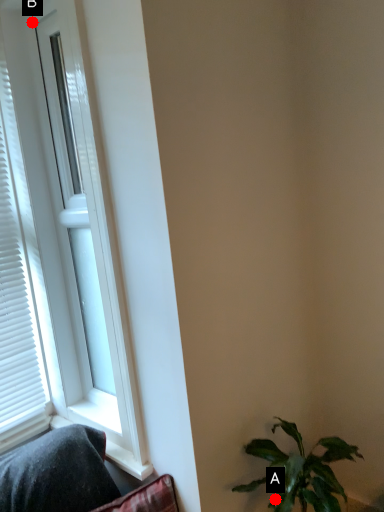
Question: Two points are circled on the image, labeled by A and B beside each circle. Which point is closer to the camera?

Choices:
 (A) A is closer
 (B) B is closer

Answer: (A)